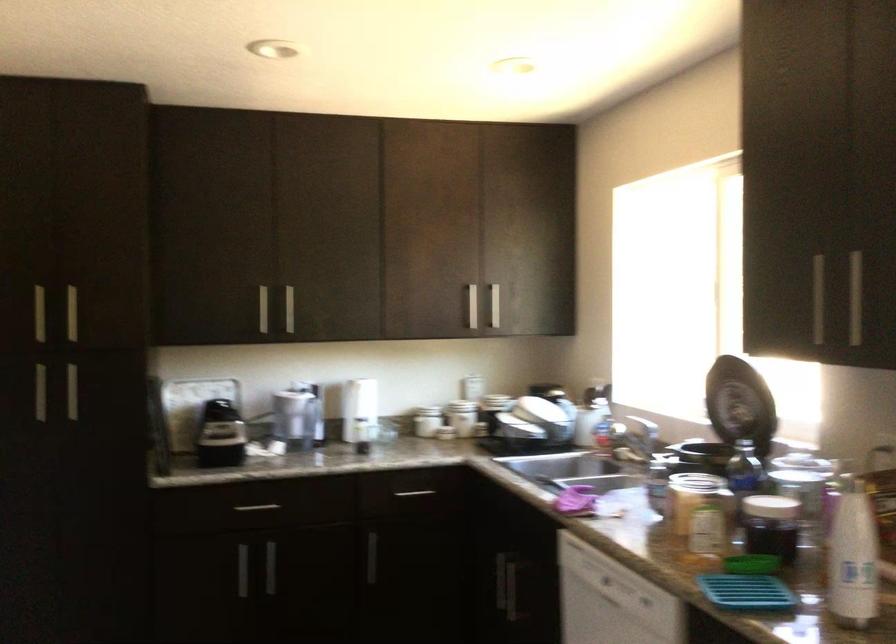
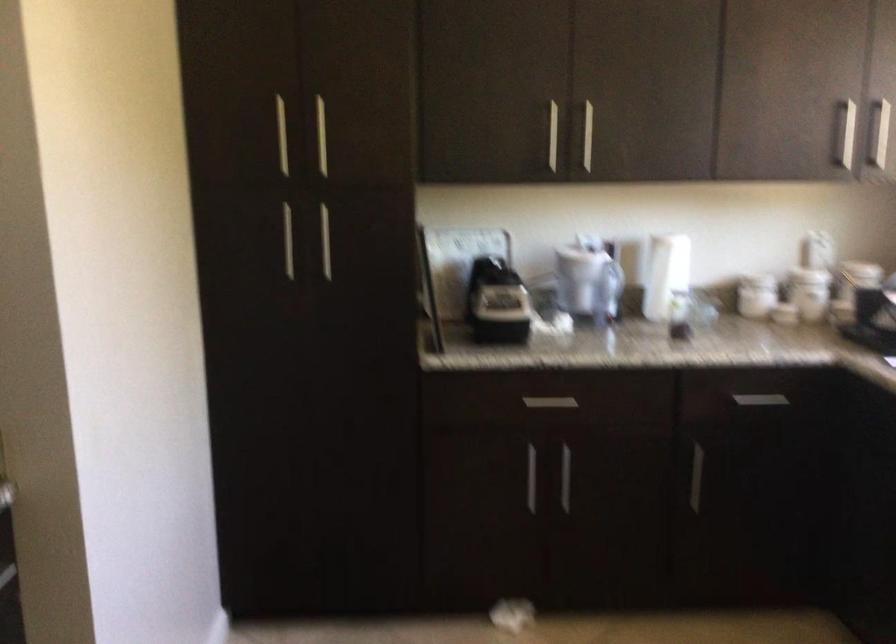
In the second image, find the point that corresponds to (452,418) in the first image.

(810, 292)